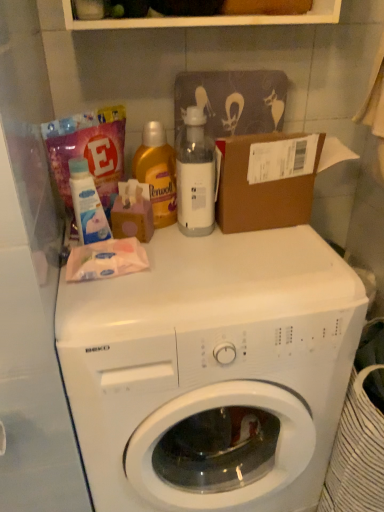
This screenshot has height=512, width=384. I want to click on vacant area that is situated to the right of pink polka dot tissue box at upper center, so click(201, 249).